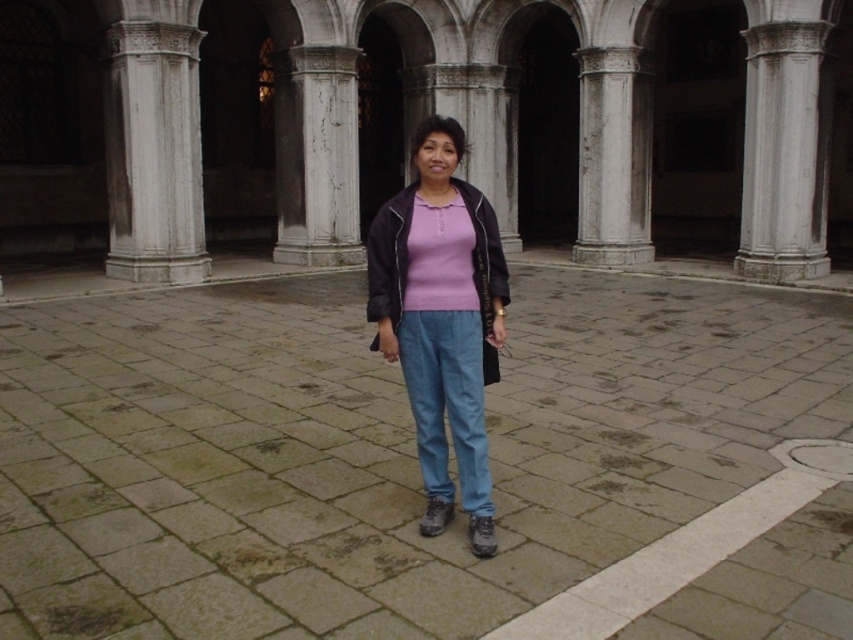
You are a tourist standing in the courtyard and want to take a photo of both the white stone column at left and the white stone column at center. Which column should you move towards to include both in your photo without moving the other?

You should move towards the white stone column at left because it is closer to you, so adjusting your position towards it will help frame both columns in the photo.

You are standing at the point with coordinates point (129, 93) and want to walk to the point with coordinates point (808, 269). Which direction should you face to walk towards your destination?

Since point (129, 93) is in front of point (808, 269), you should face backwards to walk towards your destination.

You are a photographer trying to capture a photo of the matte pink shirt at center and the white stone column at center in the courtyard. If you want to ensure both are fully visible in the frame, which object should you focus on first?

You should focus on the white stone column at center first because it is thicker than the matte pink shirt at center, making it easier to capture its details clearly.